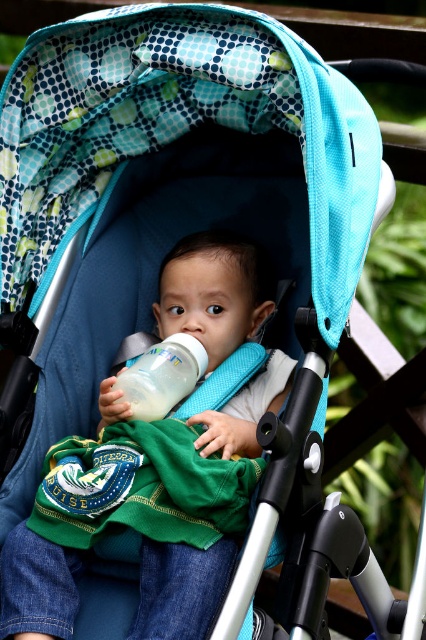
You are a parent trying to ensure your child stays hydrated. You notice the matte green shirt at center and the white opaque bottle at center. Which object is closer to the child? Please explain your reasoning based on their positions.

The matte green shirt at center is positioned under the white opaque bottle at center, meaning the bottle is above the shirt. Since the shirt is under the bottle, the white opaque bottle at center is closer to the child as it is positioned above the shirt.

You are a photographer trying to capture a closeup of the child in the stroller. You need to focus on the matte green shirt at center and the white opaque bottle at center. Which object should you zoom in on first if you want to ensure both are in focus without moving the camera?

The matte green shirt at center is larger in size than the white opaque bottle at center, so you should focus on the larger matte green shirt at center first to ensure both are in focus.